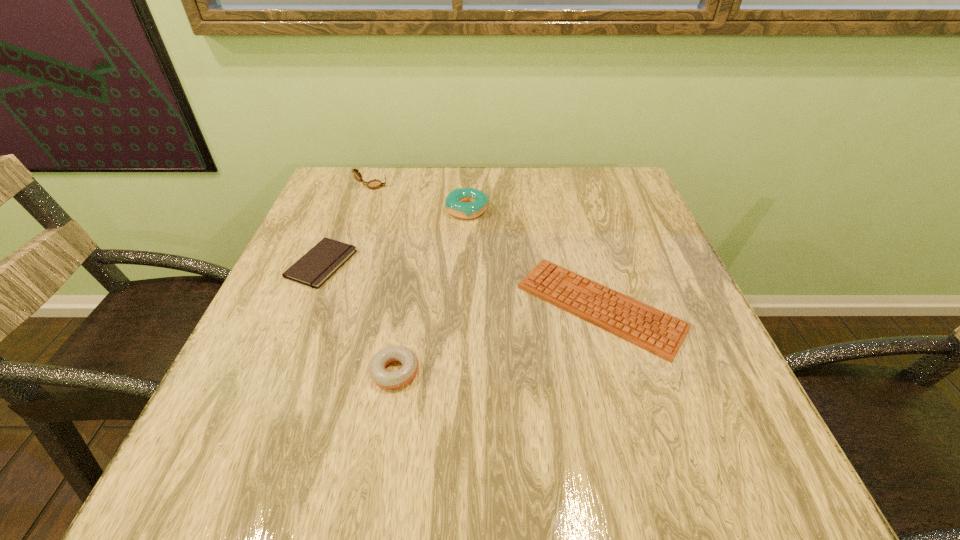
Locate an element on the screen. free point that satisfies the following two spatial constraints: 1. on the face of the computer keyboard; 2. on the left side of the farthest object is located at coordinates (329, 307).

At what (x,y) coordinates should I click in order to perform the action: click on free space in the image that satisfies the following two spatial constraints: 1. on the face of the shorter doughnut; 2. on the right side of the tallest object. Please return your answer as a coordinate pair (x, y). The image size is (960, 540). Looking at the image, I should click on (307, 372).

At what (x,y) coordinates should I click in order to perform the action: click on free point that satisfies the following two spatial constraints: 1. on the face of the rightmost object; 2. on the left side of the tallest object. Please return your answer as a coordinate pair (x, y). This screenshot has height=540, width=960. Looking at the image, I should click on (329, 307).

Locate an element on the screen. The height and width of the screenshot is (540, 960). free spot that satisfies the following two spatial constraints: 1. on the face of the tallest object; 2. on the right side of the taller doughnut is located at coordinates [364, 210].